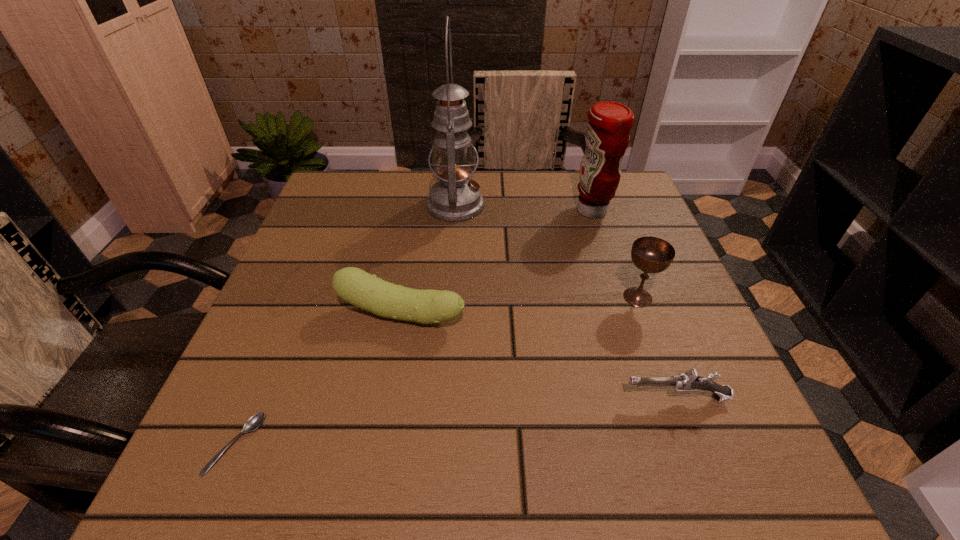
Locate an element on the screen. oil lamp is located at coordinates (455, 198).

Locate an element on the screen. The image size is (960, 540). the second tallest object is located at coordinates (607, 136).

In order to click on chalice in this screenshot , I will do `click(649, 254)`.

Locate an element on the screen. The height and width of the screenshot is (540, 960). the fourth tallest object is located at coordinates click(x=353, y=285).

Identify the location of the fifth tallest object. The height and width of the screenshot is (540, 960). (687, 382).

Where is `the second nearest object`? The height and width of the screenshot is (540, 960). the second nearest object is located at coordinates (687, 382).

In order to click on soupspoon in this screenshot , I will do `click(255, 421)`.

The image size is (960, 540). I want to click on the leftmost object, so click(255, 421).

You are a GUI agent. You are given a task and a screenshot of the screen. Output one action in this format:
    pyautogui.click(x=<x>, y=<y>)
    Task: Click on the vacant space located on the front of the oil lamp
    This screenshot has height=540, width=960.
    Given the screenshot: What is the action you would take?
    pyautogui.click(x=444, y=365)

At what (x,y) coordinates should I click in order to perform the action: click on vacant area located on the front of the condiment. Please return your answer as a coordinate pair (x, y). This screenshot has width=960, height=540. Looking at the image, I should click on (603, 245).